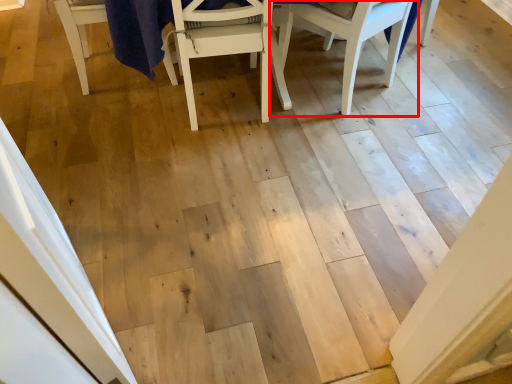
Question: From the image's perspective, what is the correct spatial positioning of chair (annotated by the red box) in reference to chair?

Choices:
 (A) above
 (B) below

Answer: (A)